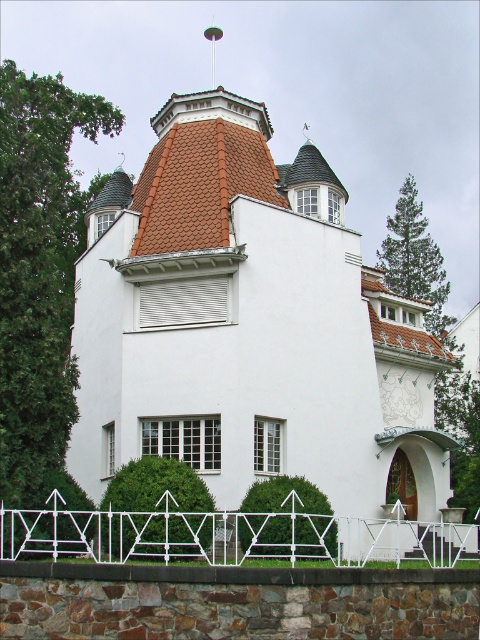
Question: Which object appears farthest from the camera in this image?

Choices:
 (A) white metal fence at lower center
 (B) white smooth house at center

Answer: (B)

Question: Where is white smooth house at center located in relation to white metal fence at lower center in the image?

Choices:
 (A) below
 (B) above

Answer: (B)

Question: Is white smooth house at center wider than white metal fence at lower center?

Choices:
 (A) yes
 (B) no

Answer: (A)

Question: Where is white smooth house at center located in relation to white metal fence at lower center in the image?

Choices:
 (A) below
 (B) above

Answer: (B)

Question: Among these objects, which one is nearest to the camera?

Choices:
 (A) white smooth house at center
 (B) white metal fence at lower center

Answer: (B)